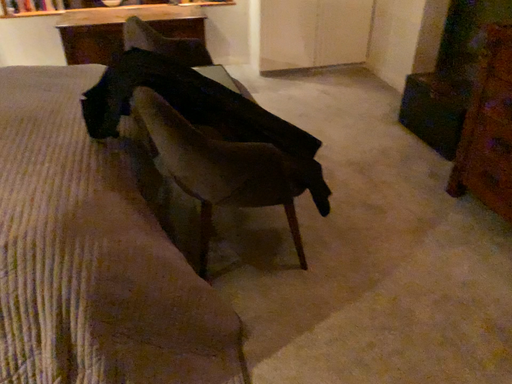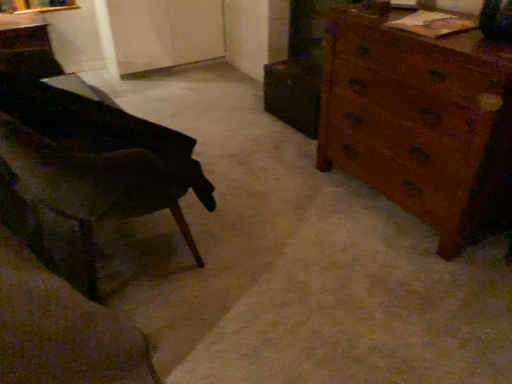
Question: How did the camera likely rotate when shooting the video?

Choices:
 (A) rotated left
 (B) rotated right

Answer: (B)